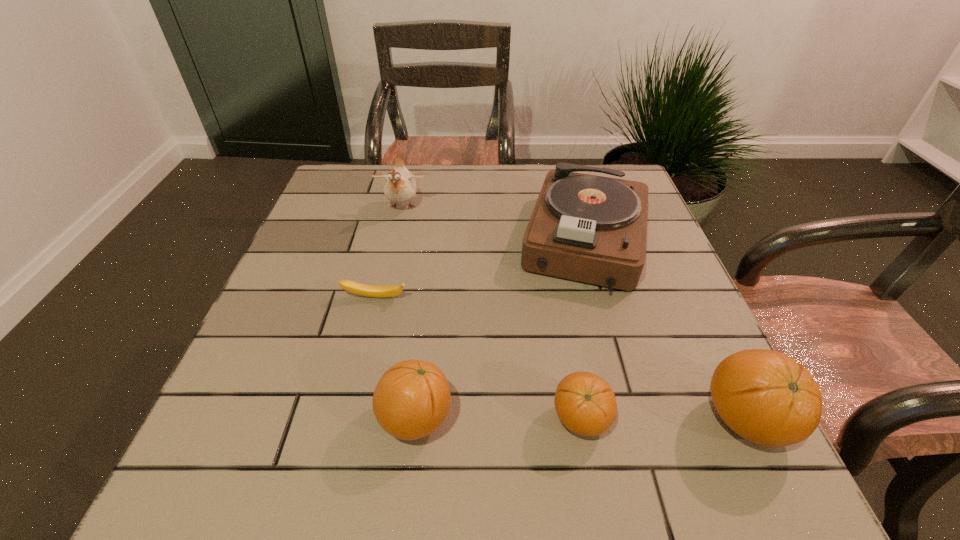
Locate an element on the screen. orange that stands as the second closest to the second tallest orange is located at coordinates (766, 397).

The height and width of the screenshot is (540, 960). In order to click on vacant space that satisfies the following two spatial constraints: 1. at the stem of the second tallest orange; 2. on the right side of the banana in this screenshot , I will do `click(347, 418)`.

Identify the location of blank area in the image that satisfies the following two spatial constraints: 1. at the beak of the bird; 2. on the right side of the fifth tallest object. Image resolution: width=960 pixels, height=540 pixels. (354, 419).

Find the location of a particular element. vacant region that satisfies the following two spatial constraints: 1. at the stem of the shortest object; 2. on the left side of the tallest orange is located at coordinates (346, 420).

This screenshot has width=960, height=540. I want to click on vacant position in the image that satisfies the following two spatial constraints: 1. on the front side of the second tallest orange; 2. on the left side of the shortest orange, so click(x=416, y=419).

I want to click on free space that satisfies the following two spatial constraints: 1. on the back side of the second shortest orange; 2. on the right side of the record player, so click(437, 240).

I want to click on vacant region that satisfies the following two spatial constraints: 1. at the beak of the bird; 2. on the left side of the second shortest object, so click(354, 419).

In order to click on vacant space that satisfies the following two spatial constraints: 1. at the stem of the banana; 2. on the right side of the second shortest orange in this screenshot , I will do `click(347, 418)`.